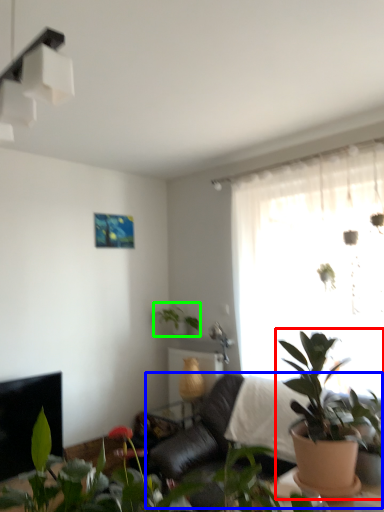
Question: Based on their relative distances, which object is farther from houseplant (highlighted by a red box)? Choose from couch (highlighted by a blue box) and houseplant (highlighted by a green box).

Choices:
 (A) couch
 (B) houseplant

Answer: (B)